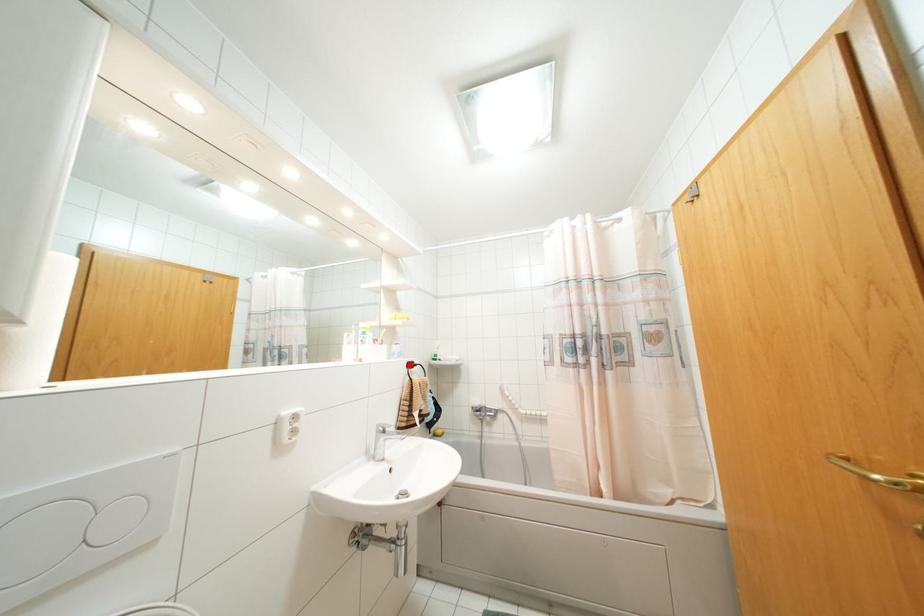
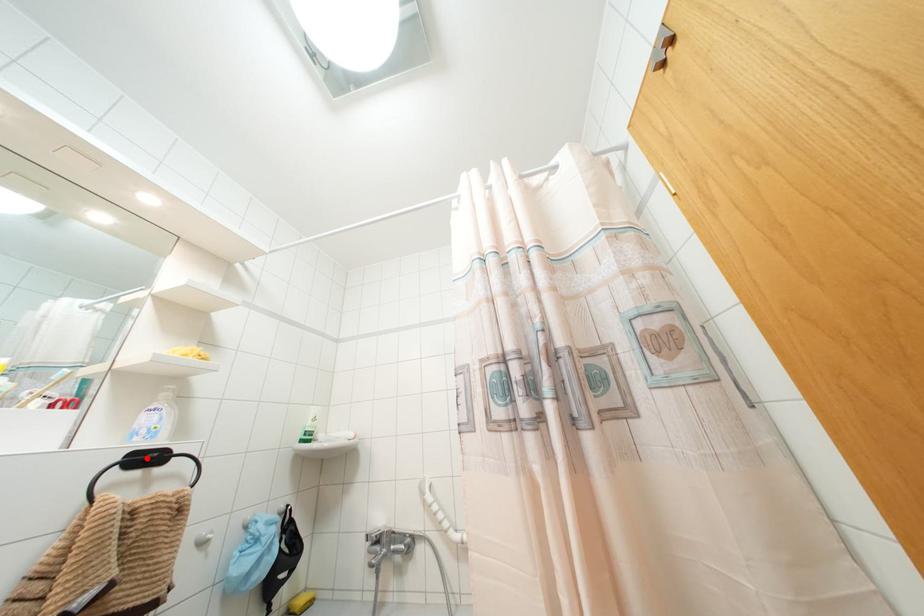
I am providing you with two images of the same scene from different viewpoints. A red point is marked on the first image and another point is marked on the second image. Is the marked point in image1 the same physical position as the marked point in image2?

Yes